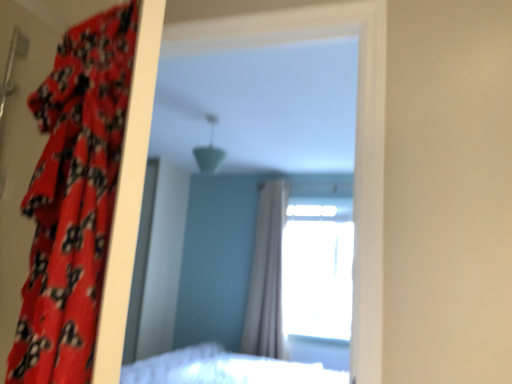
Question: Based on their sizes in the image, would you say white sheer curtain at center, the 2th curtain viewed from the front, is bigger or smaller than red floral fabric curtain at left, placed as the second curtain when sorted from right to left?

Choices:
 (A) big
 (B) small

Answer: (A)

Question: From a real-world perspective, relative to red floral fabric curtain at left, the 2th curtain positioned from the back, is white sheer curtain at center, arranged as the 1th curtain when viewed from the right, vertically above or below?

Choices:
 (A) above
 (B) below

Answer: (B)

Question: Estimate the real-world distances between objects in this image. Which object is closer to the white sheer curtain at center, the 2th curtain viewed from the front?

Choices:
 (A) matte plastic mirror at center
 (B) red floral fabric curtain at left, the 2th curtain positioned from the back
 (C) transparent glass window at upper center

Answer: (C)

Question: Based on their relative distances, which object is farther from the matte plastic mirror at center?

Choices:
 (A) white sheer curtain at center, the 2th curtain viewed from the front
 (B) transparent glass window at upper center
 (C) red floral fabric curtain at left, placed as the second curtain when sorted from right to left

Answer: (C)